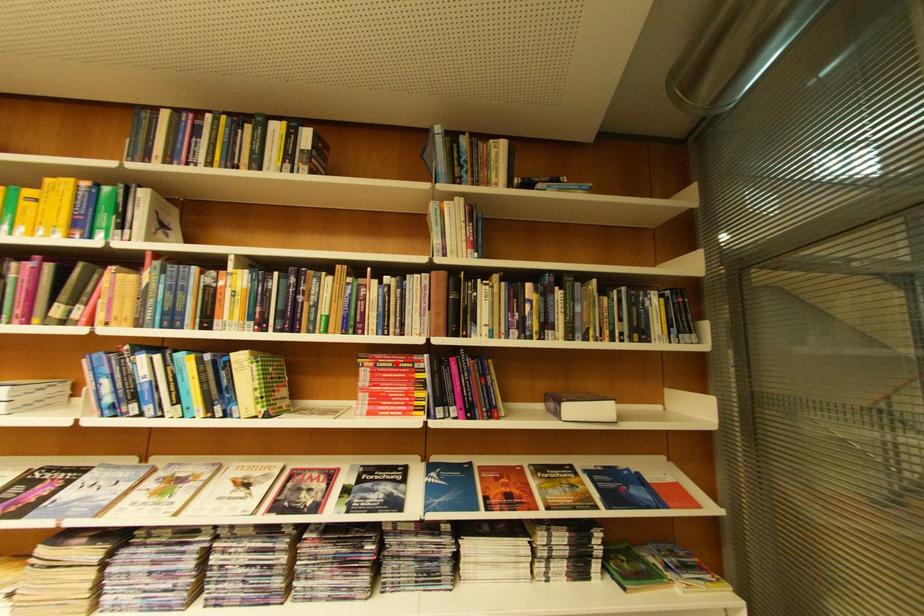
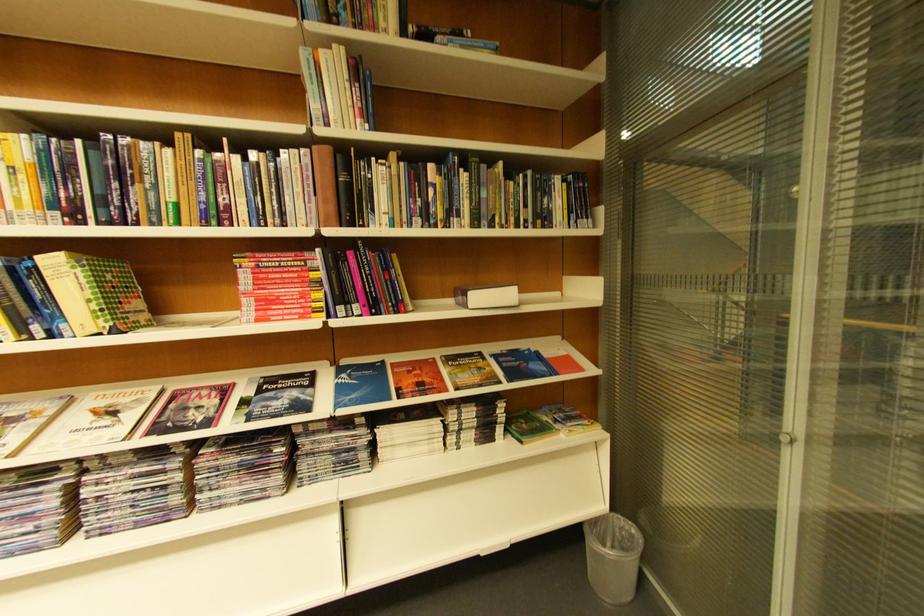
Where in the second image is the point corresponding to the highlighted location from the first image?

(281, 262)